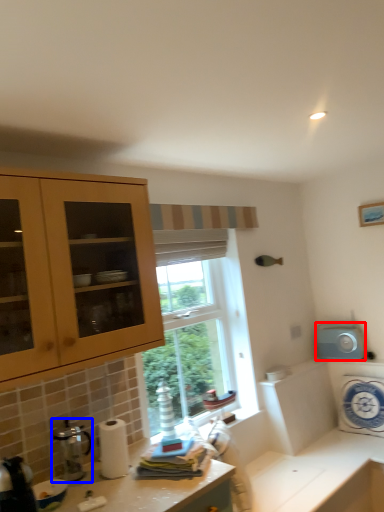
Question: Which object is closer to the camera taking this photo, appliance (highlighted by a red box) or coffee machine (highlighted by a blue box)?

Choices:
 (A) appliance
 (B) coffee machine

Answer: (B)